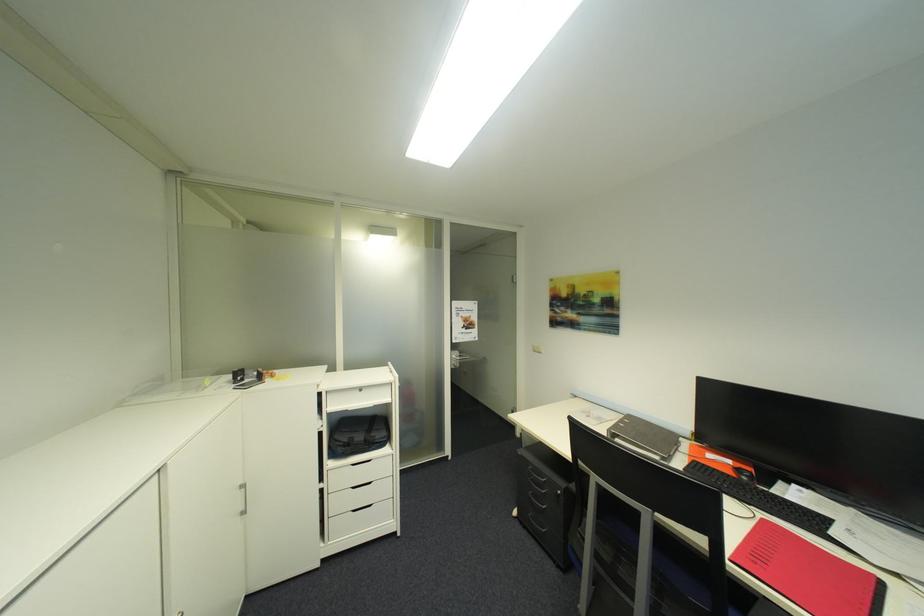
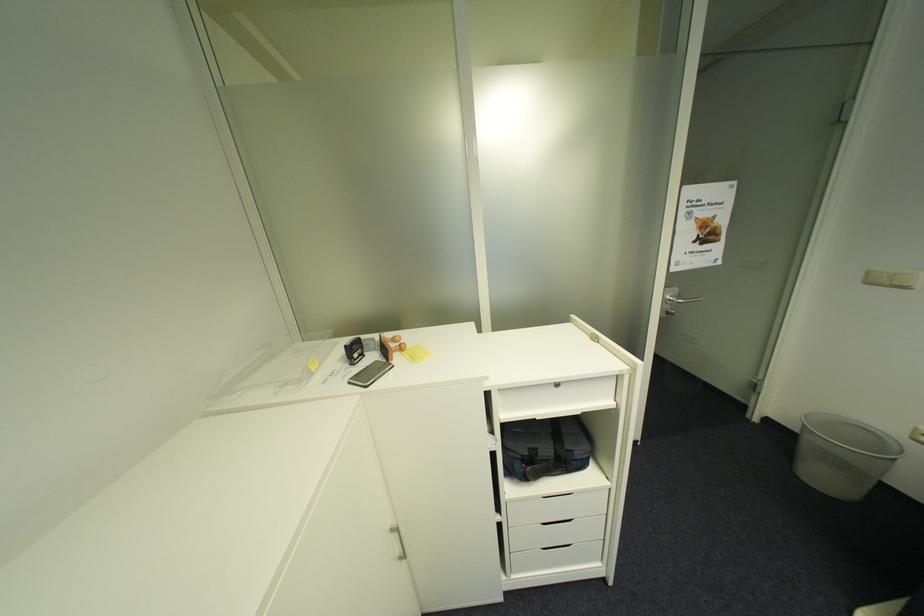
In the second image, find the point that corresponds to point 541,352 in the first image.

(876, 284)